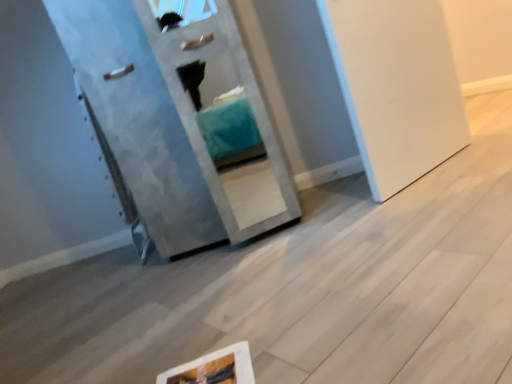
Describe the element at coordinates (174, 122) in the screenshot. This screenshot has height=384, width=512. I see `matte gray cabinet at center` at that location.

Where is `matte gray cabinet at center`? The height and width of the screenshot is (384, 512). matte gray cabinet at center is located at coordinates (174, 122).

Where is `matte gray cabinet at center`? This screenshot has width=512, height=384. matte gray cabinet at center is located at coordinates (174, 122).